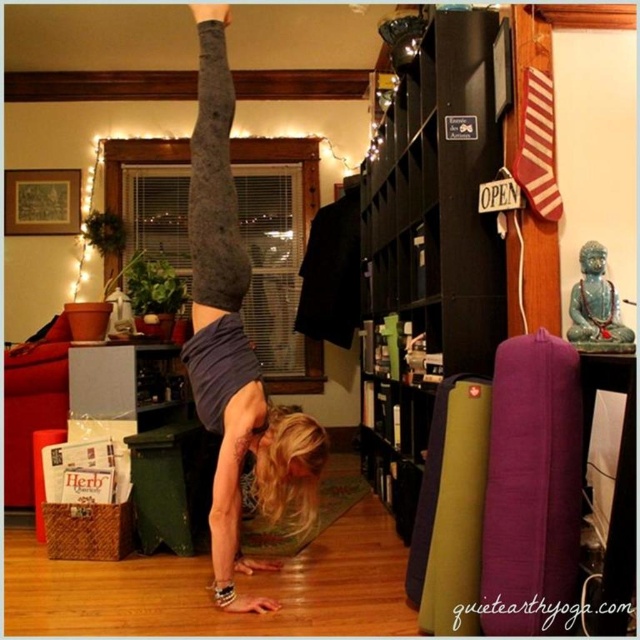
Can you confirm if black wood bookshelf at center is taller than matte gray leggings at center?

In fact, black wood bookshelf at center may be shorter than matte gray leggings at center.

Which is above, black wood bookshelf at center or matte gray leggings at center?

black wood bookshelf at center

Between point (433, 58) and point (298, 444), which one is positioned behind?

The point (433, 58) is behind.

Locate an element on the screen. The image size is (640, 640). black wood bookshelf at center is located at coordinates (428, 243).